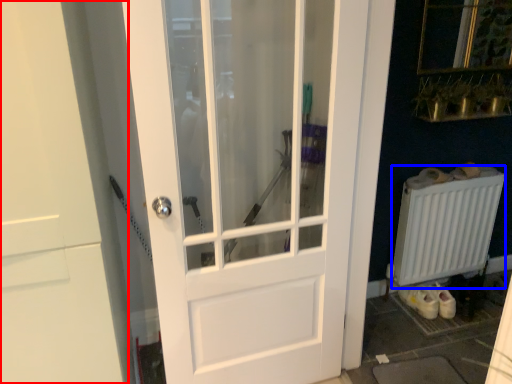
Question: Which object appears farthest to the camera in this image, door (highlighted by a red box) or radiator (highlighted by a blue box)?

Choices:
 (A) door
 (B) radiator

Answer: (B)